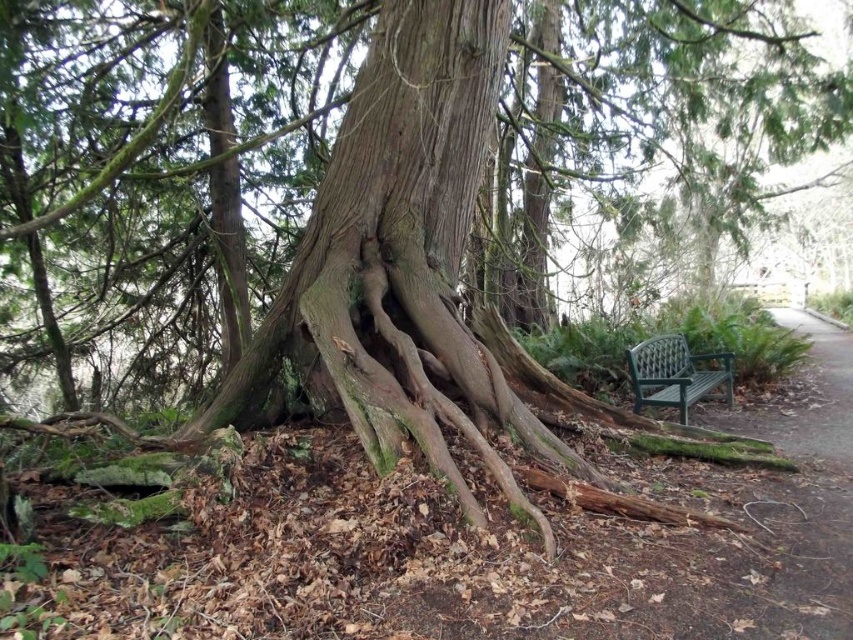
You are planning to take a nap under the tree. Which object, the smooth brown bark at center or the green plastic bench at right, would provide more shade coverage?

The smooth brown bark at center is much taller than the green plastic bench at right, so it would provide more shade coverage.

You are standing in a forest and see the point at coordinates (384, 173). What object is located at that point?

The smooth brown bark at center is located at point (384, 173).